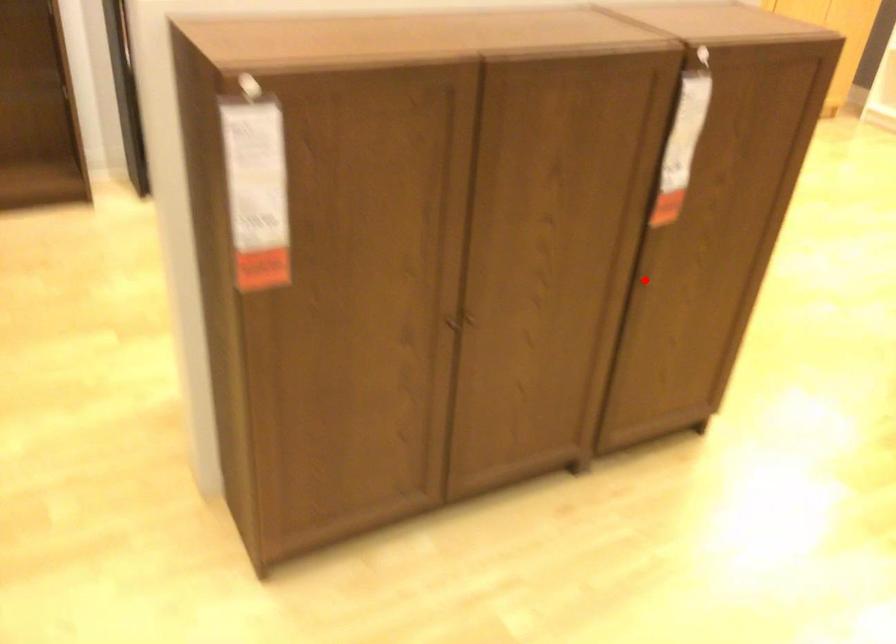
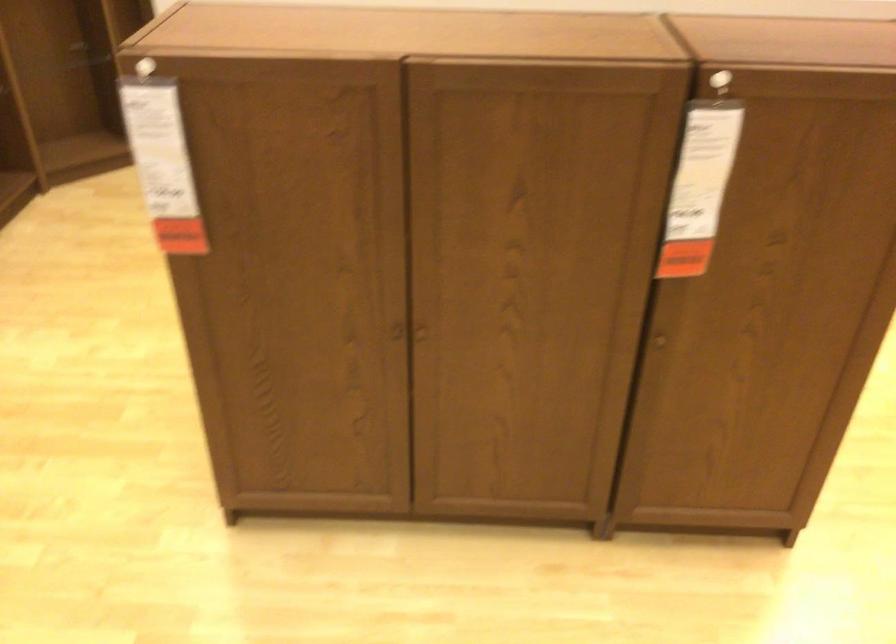
Question: I am providing you with two images of the same scene from different viewpoints. Given a red point in image1, look at the same physical point in image2. Is it:

Choices:
 (A) Closer to the viewpoint
 (B) Farther from the viewpoint

Answer: (A)